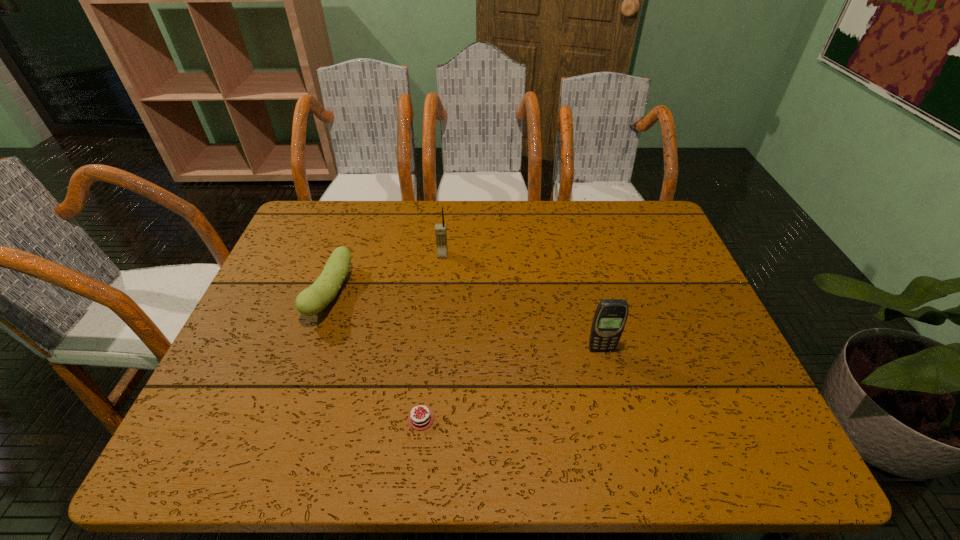
At what (x,y) coordinates should I click in order to perform the action: click on the left cellular telephone. Please return your answer as a coordinate pair (x, y). The height and width of the screenshot is (540, 960). Looking at the image, I should click on (440, 229).

Locate an element on the screen. The width and height of the screenshot is (960, 540). the farthest object is located at coordinates (440, 229).

Where is `the right cellular telephone`? The image size is (960, 540). the right cellular telephone is located at coordinates (610, 317).

Locate an element on the screen. This screenshot has width=960, height=540. the nearer cellular telephone is located at coordinates (610, 317).

Locate an element on the screen. This screenshot has width=960, height=540. cucumber is located at coordinates (312, 300).

This screenshot has width=960, height=540. Identify the location of the leftmost object. (312, 300).

Find the location of a particular element. the shortest object is located at coordinates (422, 418).

Identify the location of chocolate cake. (422, 418).

This screenshot has height=540, width=960. What are the coordinates of `vacant space situated 0.300m on the front of the farthest object, where the keypad is located` in the screenshot? It's located at (434, 343).

Find the location of a particular element. blank space located on the screen of the rightmost object is located at coordinates (611, 387).